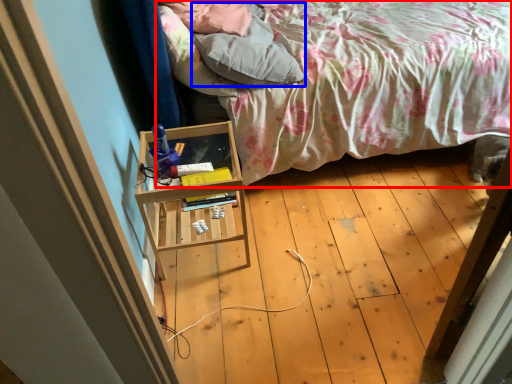
Question: Which object appears farthest to the camera in this image, bed (highlighted by a red box) or pillow (highlighted by a blue box)?

Choices:
 (A) bed
 (B) pillow

Answer: (B)